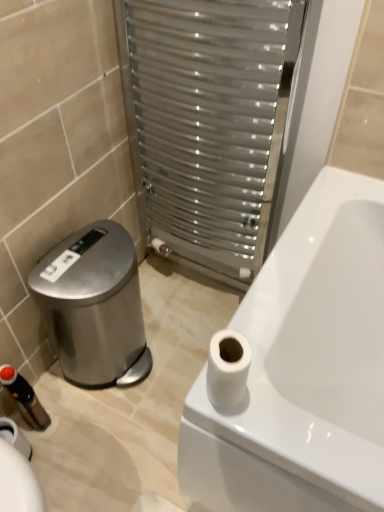
From the picture: What is the approximate height of polished stainless steel water cooler at lower left?

polished stainless steel water cooler at lower left is 17.98 inches in height.

Where is `polished stainless steel water cooler at lower left`? Image resolution: width=384 pixels, height=512 pixels. polished stainless steel water cooler at lower left is located at coordinates (93, 303).

In order to face white matte toilet paper at upper right, should I rotate leftwards or rightwards?

Rotate right and turn 4.205 degrees.

What are the coordinates of `metallic silver radiator at center` in the screenshot? It's located at (x=208, y=123).

Visually, is white matte toilet paper at upper right positioned to the left or to the right of metallic silver radiator at center?

white matte toilet paper at upper right is to the right of metallic silver radiator at center.

Is white matte toilet paper at upper right not close to metallic silver radiator at center?

That's not correct — white matte toilet paper at upper right is a little close to metallic silver radiator at center.

Is white matte toilet paper at upper right aimed at metallic silver radiator at center?

No.

Between metallic silver radiator at center and polished stainless steel water cooler at lower left, which one has more height?

metallic silver radiator at center.

From the image's perspective, is metallic silver radiator at center positioned above or below polished stainless steel water cooler at lower left?

From the image's perspective, metallic silver radiator at center appears above polished stainless steel water cooler at lower left.

Is there a large distance between metallic silver radiator at center and polished stainless steel water cooler at lower left?

metallic silver radiator at center is near polished stainless steel water cooler at lower left, not far away.

At what (x,y) coordinates should I click in order to perform the action: click on screen door that appears above the polished stainless steel water cooler at lower left (from the image's perspective). Please return your answer as a coordinate pair (x, y). This screenshot has width=384, height=512. Looking at the image, I should click on (208, 123).

Is black plastic toiletry at lower left spatially inside polished stainless steel water cooler at lower left, or outside of it?

black plastic toiletry at lower left is outside polished stainless steel water cooler at lower left.

Does black plastic toiletry at lower left have a smaller size compared to polished stainless steel water cooler at lower left?

Correct, black plastic toiletry at lower left occupies less space than polished stainless steel water cooler at lower left.

Which of these two, black plastic toiletry at lower left or polished stainless steel water cooler at lower left, is wider?

polished stainless steel water cooler at lower left.

From a real-world perspective, which is physically above, white matte toilet paper at upper right or polished stainless steel water cooler at lower left?

In real-world perspective, white matte toilet paper at upper right is above.

Between point (246, 354) and point (127, 343), which one is positioned behind?

The point (127, 343) is farther from the camera.

Is the depth of white matte toilet paper at upper right less than that of polished stainless steel water cooler at lower left?

Yes.

Is black plastic toiletry at lower left not within metallic silver radiator at center?

Yes, black plastic toiletry at lower left is located beyond the bounds of metallic silver radiator at center.

Which object is positioned more to the left, black plastic toiletry at lower left or metallic silver radiator at center?

Positioned to the left is black plastic toiletry at lower left.

Which object is wider, black plastic toiletry at lower left or metallic silver radiator at center?

Wider between the two is metallic silver radiator at center.

Between polished stainless steel water cooler at lower left and metallic silver radiator at center, which one appears on the right side from the viewer's perspective?

Positioned to the right is metallic silver radiator at center.

Does point (64, 243) come farther from viewer compared to point (217, 227)?

No, it is not.

Considering the sizes of objects polished stainless steel water cooler at lower left and metallic silver radiator at center in the image provided, who is bigger, polished stainless steel water cooler at lower left or metallic silver radiator at center?

With larger size is metallic silver radiator at center.

Could you tell me if metallic silver radiator at center is turned towards white matte toilet paper at upper right?

Yes, metallic silver radiator at center is turned towards white matte toilet paper at upper right.

What's the angular difference between metallic silver radiator at center and white matte toilet paper at upper right's facing directions?

There is a 0.272-degree angle between the facing directions of metallic silver radiator at center and white matte toilet paper at upper right.

Which is in front, metallic silver radiator at center or white matte toilet paper at upper right?

white matte toilet paper at upper right is more forward.

Which is more to the left, metallic silver radiator at center or white matte toilet paper at upper right?

From the viewer's perspective, metallic silver radiator at center appears more on the left side.

Image resolution: width=384 pixels, height=512 pixels. Find the location of `screen door lying behind the white matte toilet paper at upper right`. screen door lying behind the white matte toilet paper at upper right is located at coordinates (208, 123).

Identify the location of screen door in front of the polished stainless steel water cooler at lower left. The image size is (384, 512). pos(208,123).

Based on their spatial positions, is metallic silver radiator at center or white matte toilet paper at upper right further from black plastic toiletry at lower left?

metallic silver radiator at center is further to black plastic toiletry at lower left.

Based on their spatial positions, is polished stainless steel water cooler at lower left or black plastic toiletry at lower left further from white matte toilet paper at upper right?

The object further to white matte toilet paper at upper right is black plastic toiletry at lower left.

Considering their positions, is polished stainless steel water cooler at lower left positioned further to metallic silver radiator at center than white matte toilet paper at upper right?

white matte toilet paper at upper right.

Consider the image. Considering their positions, is metallic silver radiator at center positioned further to polished stainless steel water cooler at lower left than black plastic toiletry at lower left?

Based on the image, metallic silver radiator at center appears to be further to polished stainless steel water cooler at lower left.

From the image, which object appears to be nearer to metallic silver radiator at center, white matte toilet paper at upper right or polished stainless steel water cooler at lower left?

polished stainless steel water cooler at lower left lies closer to metallic silver radiator at center than the other object.

Looking at the image, which one is located closer to polished stainless steel water cooler at lower left, metallic silver radiator at center or white matte toilet paper at upper right?

The object closer to polished stainless steel water cooler at lower left is metallic silver radiator at center.

Which object lies nearer to the anchor point white matte toilet paper at upper right, polished stainless steel water cooler at lower left or metallic silver radiator at center?

polished stainless steel water cooler at lower left is closer to white matte toilet paper at upper right.

Estimate the real-world distances between objects in this image. Which object is closer to polished stainless steel water cooler at lower left, white matte toilet paper at upper right or black plastic toiletry at lower left?

black plastic toiletry at lower left is closer to polished stainless steel water cooler at lower left.

This screenshot has height=512, width=384. Identify the location of toilet paper between metallic silver radiator at center and black plastic toiletry at lower left in the vertical direction. point(227,368).

What are the coordinates of `water cooler between metallic silver radiator at center and white matte toilet paper at upper right in the vertical direction` in the screenshot? It's located at (93, 303).

Where is `water cooler between black plastic toiletry at lower left and white matte toilet paper at upper right in the horizontal direction`? water cooler between black plastic toiletry at lower left and white matte toilet paper at upper right in the horizontal direction is located at coordinates (93, 303).

Find the location of a particular element. The image size is (384, 512). water cooler that lies between metallic silver radiator at center and black plastic toiletry at lower left from top to bottom is located at coordinates (93, 303).